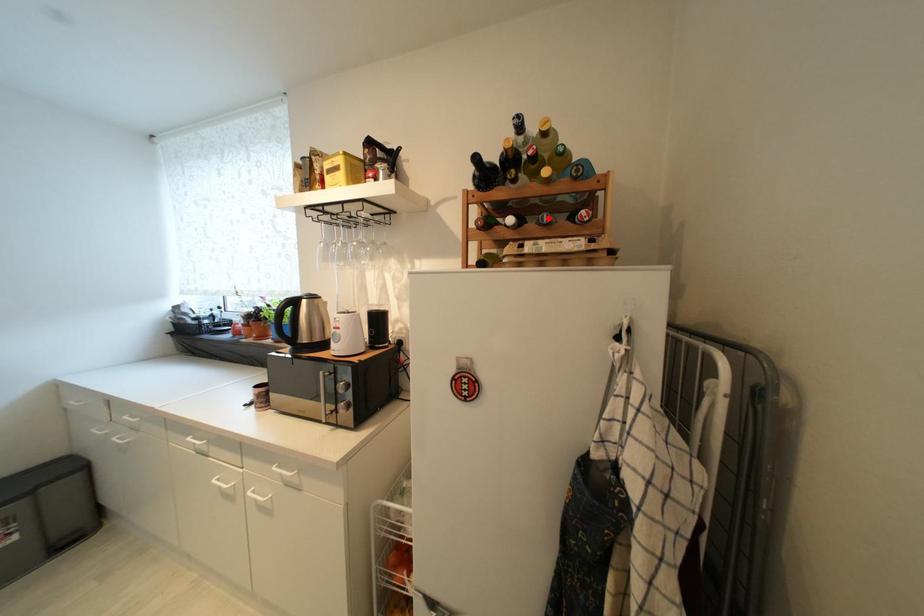
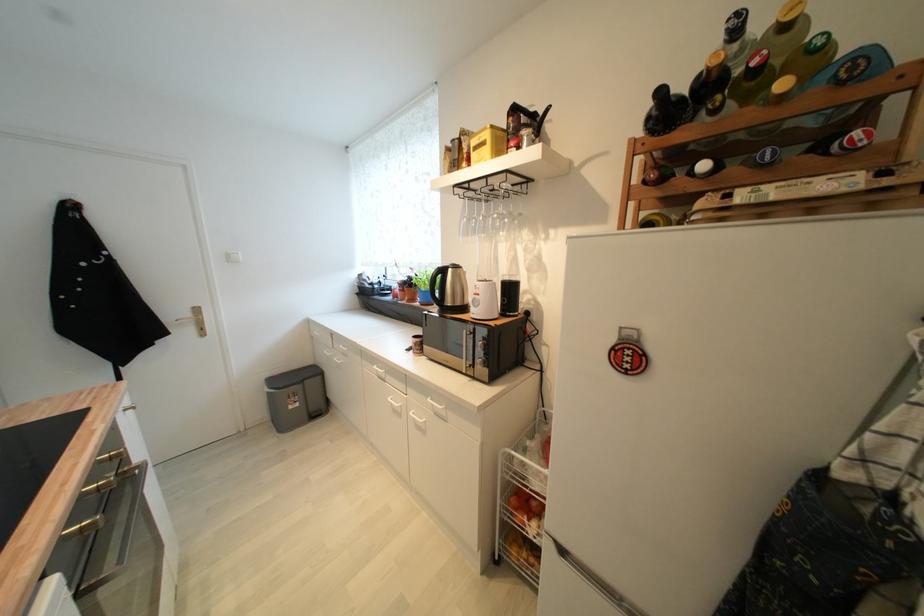
Locate, in the second image, the point that corresponds to the highlighted location in the first image.

(769, 155)